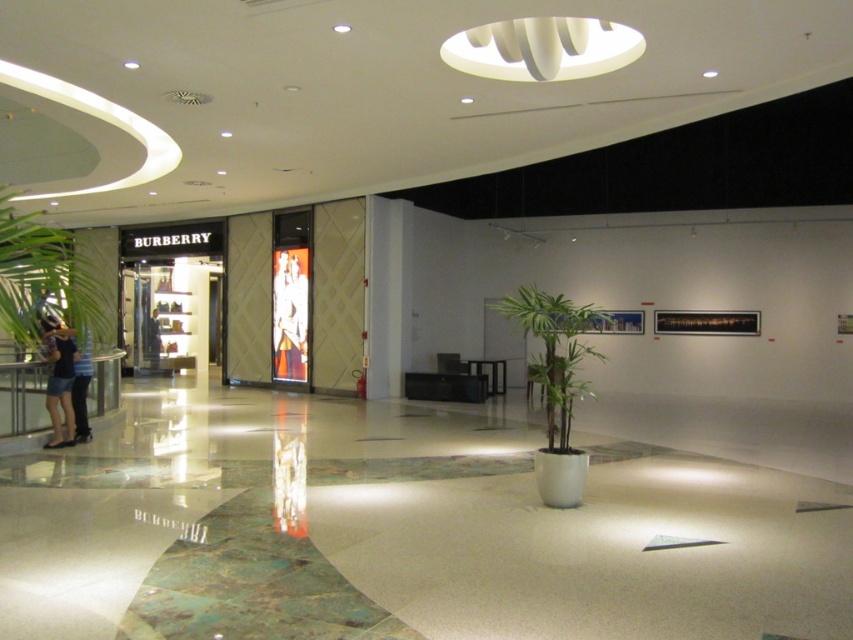
Measure the distance between matte black mannequin at center and denim pants at left.

matte black mannequin at center is 5.73 meters from denim pants at left.

Is point (283, 276) behind point (82, 424)?

Yes.

The height and width of the screenshot is (640, 853). I want to click on matte black mannequin at center, so click(289, 314).

Measure the distance between matte black mannequin at center and camera.

matte black mannequin at center is 13.63 meters away from camera.

Find the location of a particular element. The height and width of the screenshot is (640, 853). matte black mannequin at center is located at coordinates (289, 314).

This screenshot has height=640, width=853. Describe the element at coordinates (59, 381) in the screenshot. I see `denim shorts at left` at that location.

Does denim shorts at left have a smaller size compared to denim pants at left?

Indeed, denim shorts at left has a smaller size compared to denim pants at left.

Between point (59, 397) and point (80, 353), which one is positioned behind?

The point (80, 353) is behind.

This screenshot has height=640, width=853. I want to click on denim shorts at left, so click(59, 381).